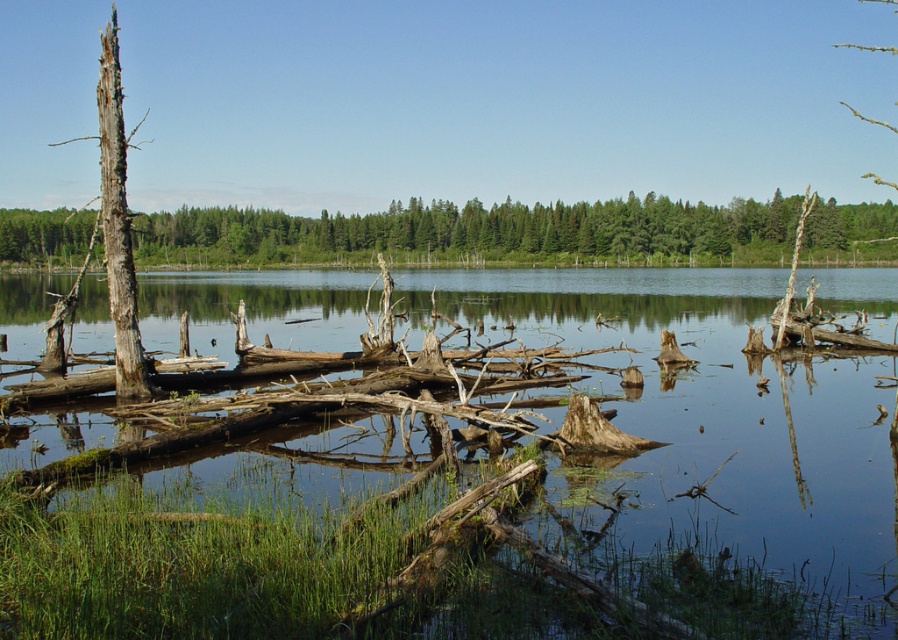
Does clear water at center have a greater height compared to dead wood at left?

In fact, clear water at center may be shorter than dead wood at left.

Is clear water at center further to camera compared to dead wood at left?

No, clear water at center is closer to the viewer.

The height and width of the screenshot is (640, 898). I want to click on clear water at center, so click(x=474, y=490).

Between clear water at center and brown rough bark tree trunk at left, which one has less height?

clear water at center

Who is taller, clear water at center or brown rough bark tree trunk at left?

With more height is brown rough bark tree trunk at left.

What do you see at coordinates (474, 490) in the screenshot?
I see `clear water at center` at bounding box center [474, 490].

Find the location of a particular element. The width and height of the screenshot is (898, 640). clear water at center is located at coordinates (474, 490).

Can you confirm if dead wood at left is positioned above brown rough bark tree trunk at left?

No.

Which is more to the right, dead wood at left or brown rough bark tree trunk at left?

dead wood at left

You are a GUI agent. You are given a task and a screenshot of the screen. Output one action in this format:
    pyautogui.click(x=<x>, y=<y>)
    Task: Click on the dead wood at left
    The width and height of the screenshot is (898, 640).
    Given the screenshot: What is the action you would take?
    pyautogui.click(x=476, y=232)